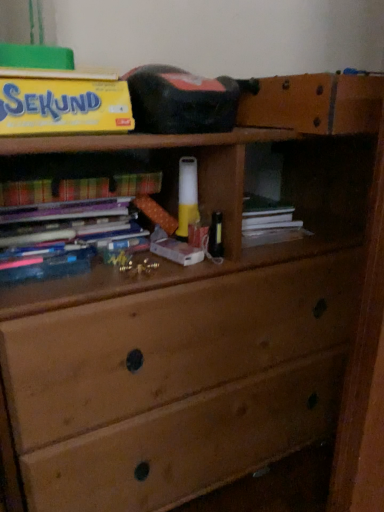
Question: Does point (8, 190) appear closer or farther from the camera than point (71, 108)?

Choices:
 (A) farther
 (B) closer

Answer: (A)

Question: From the image's perspective, is multicolored paper book at left positioned above or below yellow matte paper at upper left?

Choices:
 (A) below
 (B) above

Answer: (A)

Question: Considering the positions of multicolored paper book at left and yellow matte paper at upper left in the image, is multicolored paper book at left bigger or smaller than yellow matte paper at upper left?

Choices:
 (A) small
 (B) big

Answer: (A)

Question: From a real-world perspective, is yellow matte paper at upper left positioned above or below multicolored paper book at left?

Choices:
 (A) above
 (B) below

Answer: (A)

Question: Does point (41, 102) appear closer or farther from the camera than point (74, 198)?

Choices:
 (A) closer
 (B) farther

Answer: (A)

Question: From the image's perspective, relative to multicolored paper book at left, is yellow matte paper at upper left above or below?

Choices:
 (A) below
 (B) above

Answer: (B)

Question: Considering the positions of yellow matte paper at upper left and multicolored paper book at left in the image, is yellow matte paper at upper left wider or thinner than multicolored paper book at left?

Choices:
 (A) wide
 (B) thin

Answer: (A)